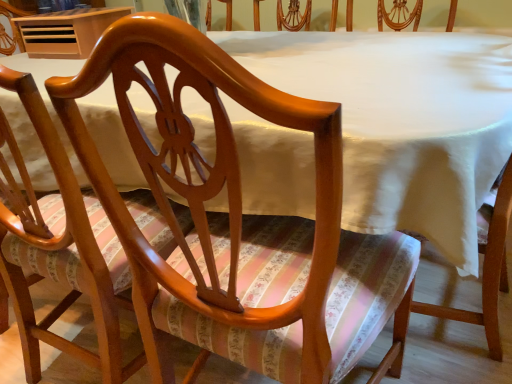
I want to click on glossy wood chair at center, placed as the 1th chair when sorted from left to right, so click(x=58, y=245).

Identify the location of glossy wood chair at center, the 2th chair in the left-to-right sequence. Image resolution: width=512 pixels, height=384 pixels. (238, 222).

Locate an element on the screen. The image size is (512, 384). wooden table at upper left is located at coordinates coord(66,31).

Identify the location of glossy wood chair at center, placed as the 1th chair when sorted from left to right. (58, 245).

Locate an element on the screen. The width and height of the screenshot is (512, 384). table above the glossy wood chair at center, the 2th chair in the left-to-right sequence (from the image's perspective) is located at coordinates (66, 31).

Looking at this image, is glossy wood chair at center, the 2th chair in the left-to-right sequence, positioned with its back to wooden table at upper left?

No, glossy wood chair at center, the 2th chair in the left-to-right sequence, is not facing the opposite direction of wooden table at upper left.

Is glossy wood chair at center, the first chair viewed from the right, surrounding wooden table at upper left?

No, wooden table at upper left is not a part of glossy wood chair at center, the first chair viewed from the right.

Considering the positions of objects glossy wood chair at center, the first chair viewed from the right, and wooden table at upper left in the image provided, who is more to the right, glossy wood chair at center, the first chair viewed from the right, or wooden table at upper left?

glossy wood chair at center, the first chair viewed from the right.

Considering the positions of objects glossy wood chair at center, the first chair viewed from the right, and glossy wood chair at center, placed as the 1th chair when sorted from left to right, in the image provided, who is more to the right, glossy wood chair at center, the first chair viewed from the right, or glossy wood chair at center, placed as the 1th chair when sorted from left to right,?

Positioned to the right is glossy wood chair at center, the first chair viewed from the right.

The width and height of the screenshot is (512, 384). Identify the location of chair below the glossy wood chair at center, the first chair viewed from the right (from a real-world perspective). (58, 245).

Is glossy wood chair at center, the 2th chair in the left-to-right sequence, turned away from glossy wood chair at center, placed as the 1th chair when sorted from left to right?

That's not correct — glossy wood chair at center, the 2th chair in the left-to-right sequence, is not looking away from glossy wood chair at center, placed as the 1th chair when sorted from left to right.

Is glossy wood chair at center, placed as the 1th chair when sorted from left to right, outside of glossy wood chair at center, the first chair viewed from the right?

That's correct, glossy wood chair at center, placed as the 1th chair when sorted from left to right, is outside of glossy wood chair at center, the first chair viewed from the right.

Could you tell me if glossy wood chair at center, arranged as the 2th chair when viewed from the right, is turned towards glossy wood chair at center, the 2th chair in the left-to-right sequence?

No, glossy wood chair at center, arranged as the 2th chair when viewed from the right, is not facing towards glossy wood chair at center, the 2th chair in the left-to-right sequence.

In the image, is glossy wood chair at center, placed as the 1th chair when sorted from left to right, on the left side or the right side of glossy wood chair at center, the first chair viewed from the right?

glossy wood chair at center, placed as the 1th chair when sorted from left to right, is to the left of glossy wood chair at center, the first chair viewed from the right.

Measure the distance from glossy wood chair at center, arranged as the 2th chair when viewed from the right, to glossy wood chair at center, the 2th chair in the left-to-right sequence.

glossy wood chair at center, arranged as the 2th chair when viewed from the right, is 28.04 centimeters away from glossy wood chair at center, the 2th chair in the left-to-right sequence.

Is wooden table at upper left touching glossy wood chair at center, the 2th chair in the left-to-right sequence?

There is a gap between wooden table at upper left and glossy wood chair at center, the 2th chair in the left-to-right sequence.

The width and height of the screenshot is (512, 384). In order to click on the 2nd chair below when counting from the wooden table at upper left (from the image's perspective) in this screenshot , I will do `click(238, 222)`.

Between wooden table at upper left and glossy wood chair at center, the 2th chair in the left-to-right sequence, which one has larger size?

With larger size is glossy wood chair at center, the 2th chair in the left-to-right sequence.

Which is behind, wooden table at upper left or glossy wood chair at center, placed as the 1th chair when sorted from left to right?

wooden table at upper left is more distant.

Based on their sizes in the image, would you say wooden table at upper left is bigger or smaller than glossy wood chair at center, placed as the 1th chair when sorted from left to right?

Considering their sizes, wooden table at upper left takes up less space than glossy wood chair at center, placed as the 1th chair when sorted from left to right.

Considering the sizes of wooden table at upper left and glossy wood chair at center, arranged as the 2th chair when viewed from the right, in the image, is wooden table at upper left taller or shorter than glossy wood chair at center, arranged as the 2th chair when viewed from the right,?

wooden table at upper left is shorter than glossy wood chair at center, arranged as the 2th chair when viewed from the right.

Considering the relative positions of glossy wood chair at center, placed as the 1th chair when sorted from left to right, and wooden table at upper left in the image provided, is glossy wood chair at center, placed as the 1th chair when sorted from left to right, behind wooden table at upper left?

No, it is not.

Which object is positioned more to the left, glossy wood chair at center, placed as the 1th chair when sorted from left to right, or wooden table at upper left?

wooden table at upper left is more to the left.

From a real-world perspective, is glossy wood chair at center, placed as the 1th chair when sorted from left to right, beneath wooden table at upper left?

Yes, from a real-world perspective, glossy wood chair at center, placed as the 1th chair when sorted from left to right, is beneath wooden table at upper left.

From the wooden table at upper left, count 2nd chair to the right and point to it. Please provide its 2D coordinates.

[(238, 222)]

Image resolution: width=512 pixels, height=384 pixels. Identify the location of chair lying behind the glossy wood chair at center, the first chair viewed from the right. (58, 245).

Looking at the image, which one is located further to glossy wood chair at center, the 2th chair in the left-to-right sequence, glossy wood chair at center, placed as the 1th chair when sorted from left to right, or wooden table at upper left?

Among the two, wooden table at upper left is located further to glossy wood chair at center, the 2th chair in the left-to-right sequence.

Based on their spatial positions, is glossy wood chair at center, the 2th chair in the left-to-right sequence, or glossy wood chair at center, arranged as the 2th chair when viewed from the right, closer to wooden table at upper left?

glossy wood chair at center, arranged as the 2th chair when viewed from the right, is closer to wooden table at upper left.

Considering their positions, is glossy wood chair at center, placed as the 1th chair when sorted from left to right, positioned further to wooden table at upper left than glossy wood chair at center, the 2th chair in the left-to-right sequence?

Based on the image, glossy wood chair at center, the 2th chair in the left-to-right sequence, appears to be further to wooden table at upper left.

Based on their spatial positions, is wooden table at upper left or glossy wood chair at center, the 2th chair in the left-to-right sequence, further from glossy wood chair at center, placed as the 1th chair when sorted from left to right?

wooden table at upper left is further to glossy wood chair at center, placed as the 1th chair when sorted from left to right.

When comparing their distances from glossy wood chair at center, the first chair viewed from the right, does wooden table at upper left or glossy wood chair at center, arranged as the 2th chair when viewed from the right, seem closer?

glossy wood chair at center, arranged as the 2th chair when viewed from the right, lies closer to glossy wood chair at center, the first chair viewed from the right, than the other object.

Which object lies nearer to the anchor point glossy wood chair at center, arranged as the 2th chair when viewed from the right, glossy wood chair at center, the 2th chair in the left-to-right sequence, or wooden table at upper left?

glossy wood chair at center, the 2th chair in the left-to-right sequence, is positioned closer to the anchor glossy wood chair at center, arranged as the 2th chair when viewed from the right.

The width and height of the screenshot is (512, 384). Identify the location of chair between glossy wood chair at center, the 2th chair in the left-to-right sequence, and wooden table at upper left, along the z-axis. (58, 245).